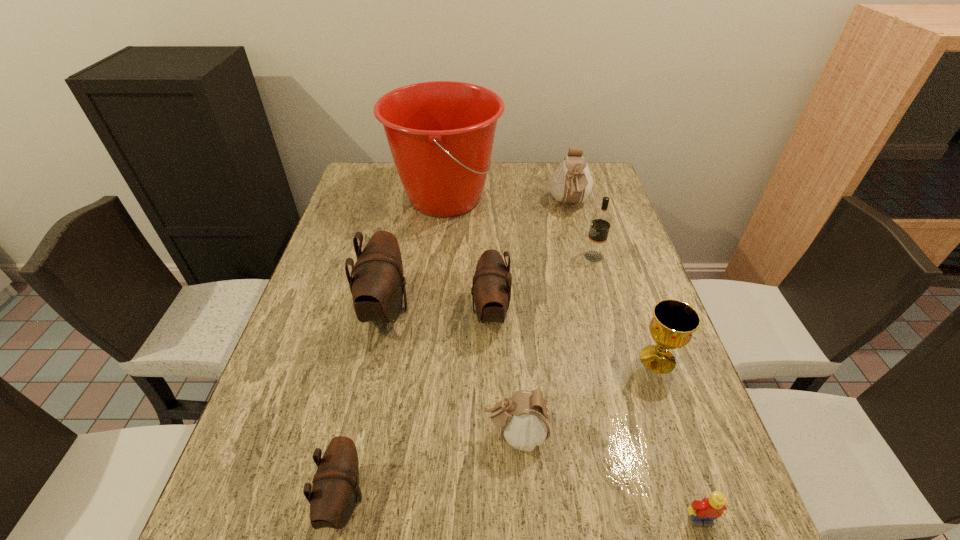
Locate an element on the screen. pouch that is at the right edge is located at coordinates (571, 182).

You are a GUI agent. You are given a task and a screenshot of the screen. Output one action in this format:
    pyautogui.click(x=<x>, y=<y>)
    Task: Click on the chalice located in the right edge section of the desktop
    
    Given the screenshot: What is the action you would take?
    (673, 323)

At what (x,y) coordinates should I click in order to perform the action: click on Lego at the right edge. Please return your answer as a coordinate pair (x, y). Looking at the image, I should click on (703, 512).

What are the coordinates of `object that is at the far left corner` in the screenshot? It's located at (441, 133).

Locate an element on the screen. The width and height of the screenshot is (960, 540). object that is positioned at the far right corner is located at coordinates (571, 182).

You are a GUI agent. You are given a task and a screenshot of the screen. Output one action in this format:
    pyautogui.click(x=<x>, y=<y>)
    Task: Click on the blank space at the far edge of the desktop
    This screenshot has height=540, width=960.
    Given the screenshot: What is the action you would take?
    pyautogui.click(x=519, y=179)

You are a GUI agent. You are given a task and a screenshot of the screen. Output one action in this format:
    pyautogui.click(x=<x>, y=<y>)
    Task: Click on the vacant space at the left edge
    This screenshot has width=960, height=540.
    Given the screenshot: What is the action you would take?
    pyautogui.click(x=332, y=274)

I want to click on free space at the right edge of the desktop, so click(x=639, y=380).

Identify the location of free space between the gold chalice and the second biggest brown pouch. (574, 336).

Image resolution: width=960 pixels, height=540 pixels. Find the location of `vacant area that lies between the yellow Lego and the second smallest brown pouch`. vacant area that lies between the yellow Lego and the second smallest brown pouch is located at coordinates (595, 416).